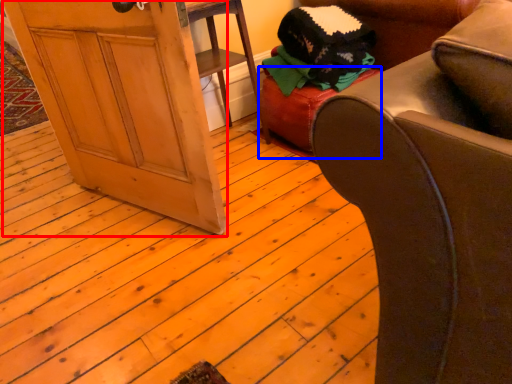
Question: Which point is closer to the camera, screen door (highlighted by a red box) or stool (highlighted by a blue box)?

Choices:
 (A) screen door
 (B) stool

Answer: (A)